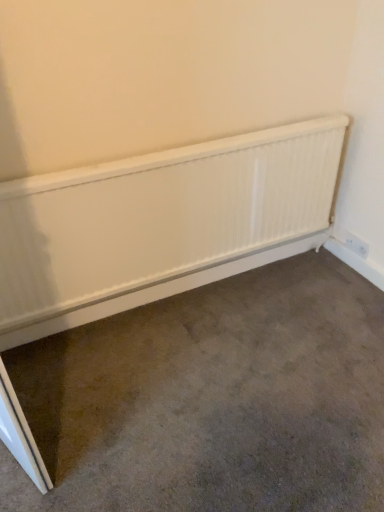
Question: Which is correct: white matte radiator at center is inside white plastic electric outlet at lower right, or outside of it?

Choices:
 (A) outside
 (B) inside

Answer: (A)

Question: Based on their positions, is white matte radiator at center located to the left or right of white plastic electric outlet at lower right?

Choices:
 (A) left
 (B) right

Answer: (A)

Question: Estimate the real-world distances between objects in this image. Which object is farther from the white textured radiator at center?

Choices:
 (A) white matte radiator at center
 (B) white plastic electric outlet at lower right

Answer: (B)

Question: Which is nearer to the white plastic electric outlet at lower right?

Choices:
 (A) white textured radiator at center
 (B) white matte radiator at center

Answer: (A)